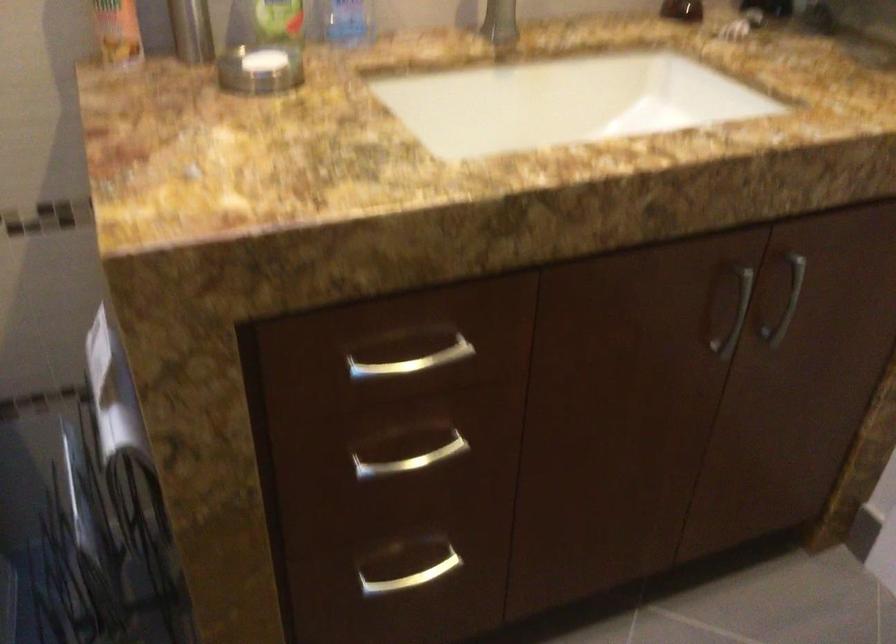
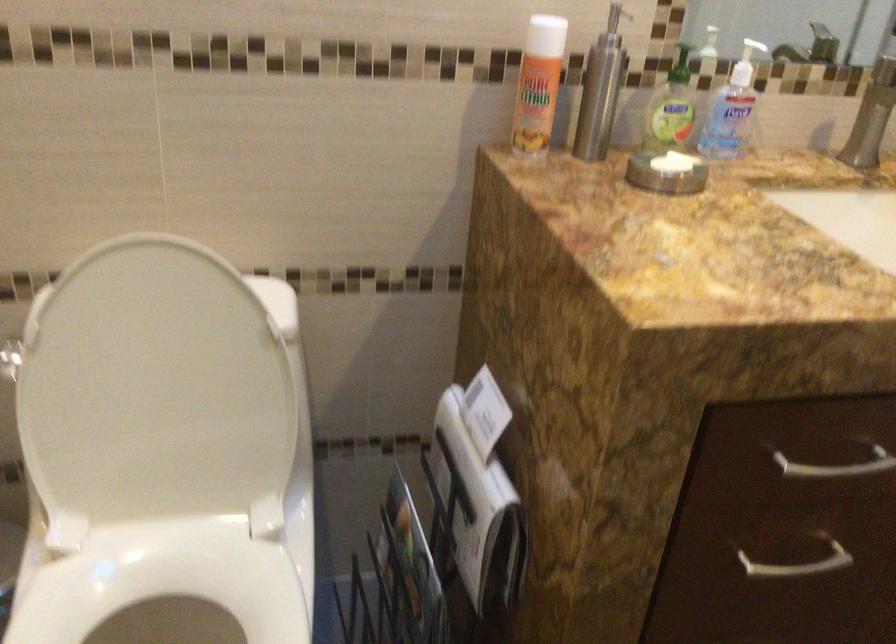
In the second image, find the point that corresponds to point (427, 362) in the first image.

(837, 466)